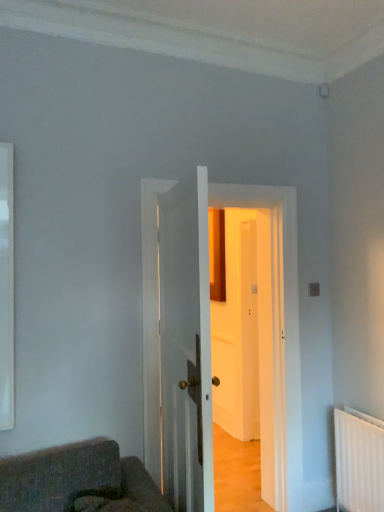
Question: Is white glossy window at left facing away from white glossy door at center, the first door when ordered from front to back?

Choices:
 (A) no
 (B) yes

Answer: (A)

Question: From the image's perspective, is white glossy window at left located above white glossy door at center, the 2th door in the back-to-front sequence?

Choices:
 (A) yes
 (B) no

Answer: (A)

Question: Considering the relative positions of white glossy window at left and white glossy door at center, the 2th door in the back-to-front sequence, in the image provided, is white glossy window at left to the right of white glossy door at center, the 2th door in the back-to-front sequence, from the viewer's perspective?

Choices:
 (A) yes
 (B) no

Answer: (B)

Question: From the image's perspective, is white glossy window at left located beneath white glossy door at center, the first door when ordered from front to back?

Choices:
 (A) yes
 (B) no

Answer: (B)

Question: Can you confirm if white glossy window at left is thinner than white glossy door at center, the 2th door in the back-to-front sequence?

Choices:
 (A) no
 (B) yes

Answer: (B)

Question: Is white wooden door at center, placed as the first door when sorted from back to front, to the left or to the right of white glossy door at center, the 2th door in the back-to-front sequence, in the image?

Choices:
 (A) left
 (B) right

Answer: (B)

Question: Is white wooden door at center, the 2th door from the front, inside or outside of white glossy door at center, the 2th door in the back-to-front sequence?

Choices:
 (A) outside
 (B) inside

Answer: (A)

Question: Considering the positions of white wooden door at center, the 2th door from the front, and white glossy door at center, the 2th door in the back-to-front sequence, in the image, is white wooden door at center, the 2th door from the front, wider or thinner than white glossy door at center, the 2th door in the back-to-front sequence,?

Choices:
 (A) wide
 (B) thin

Answer: (A)

Question: Is white wooden door at center, placed as the first door when sorted from back to front, taller or shorter than white glossy door at center, the 2th door in the back-to-front sequence?

Choices:
 (A) short
 (B) tall

Answer: (B)

Question: Choose the correct answer: Is white glossy window at left inside white wooden door at center, the 2th door from the front, or outside it?

Choices:
 (A) outside
 (B) inside

Answer: (A)

Question: Is point (3, 402) closer or farther from the camera than point (291, 278)?

Choices:
 (A) farther
 (B) closer

Answer: (B)

Question: Looking at their shapes, would you say white glossy window at left is wider or thinner than white wooden door at center, placed as the first door when sorted from back to front?

Choices:
 (A) thin
 (B) wide

Answer: (A)

Question: From the image's perspective, is white glossy window at left located above or below white wooden door at center, the 2th door from the front?

Choices:
 (A) below
 (B) above

Answer: (B)

Question: Considering the positions of white glossy door at center, the first door when ordered from front to back, and white wooden door at center, placed as the first door when sorted from back to front, in the image, is white glossy door at center, the first door when ordered from front to back, taller or shorter than white wooden door at center, placed as the first door when sorted from back to front,?

Choices:
 (A) tall
 (B) short

Answer: (B)

Question: Considering the positions of white glossy door at center, the first door when ordered from front to back, and white wooden door at center, placed as the first door when sorted from back to front, in the image, is white glossy door at center, the first door when ordered from front to back, bigger or smaller than white wooden door at center, placed as the first door when sorted from back to front,?

Choices:
 (A) small
 (B) big

Answer: (A)